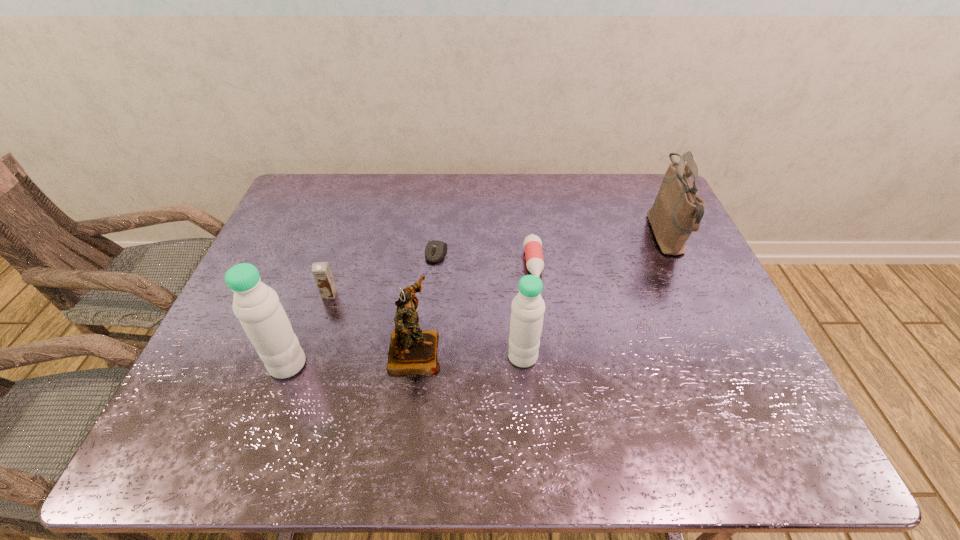
Find the location of a particular element. This screenshot has width=960, height=540. free space for a new water bottle on the right is located at coordinates (751, 348).